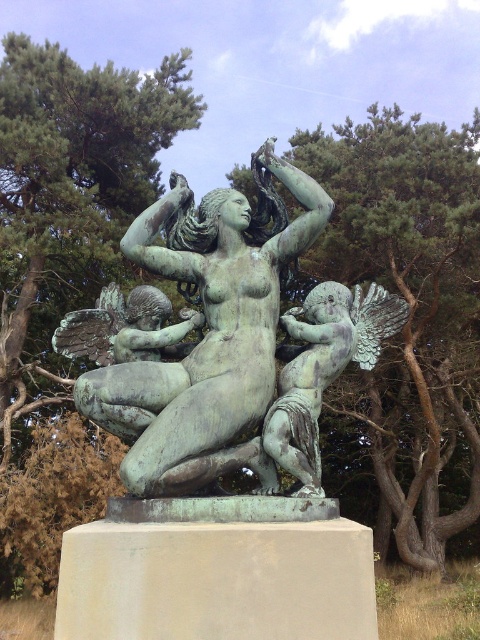
Describe the element at coordinates (406, 324) in the screenshot. I see `green textured tree at center` at that location.

Does green textured tree at center appear on the right side of bronze cherub at center?

Yes, green textured tree at center is to the right of bronze cherub at center.

The width and height of the screenshot is (480, 640). I want to click on green textured tree at center, so click(x=406, y=324).

Find the location of a particular element. The image size is (480, 640). green textured tree at center is located at coordinates (406, 324).

Can you confirm if green patina bronze statue at center is thinner than bronze cherub at center?

Incorrect, green patina bronze statue at center's width is not less than bronze cherub at center's.

Consider the image. Is the position of green patina bronze statue at center less distant than that of bronze cherub at center?

Yes, green patina bronze statue at center is closer to the viewer.

Who is more distant from viewer, (202, 435) or (325, 385)?

Point (325, 385)

I want to click on green patina bronze statue at center, so click(x=206, y=323).

Is point (360, 268) positioned behind point (222, 314)?

Yes, point (360, 268) is farther from viewer.

Which is above, green textured tree at center or green patina bronze statue at center?

green textured tree at center is higher up.

Does point (422, 316) come in front of point (260, 410)?

No, (422, 316) is behind (260, 410).

Where is `green textured tree at center`? Image resolution: width=480 pixels, height=640 pixels. green textured tree at center is located at coordinates coord(406,324).